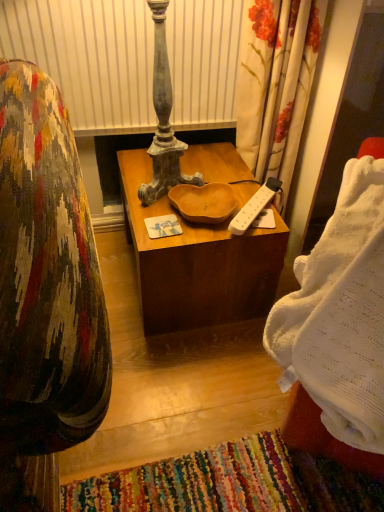
Locate an element on the screen. Image resolution: width=384 pixels, height=512 pixels. vacant point to the left of white knitted blanket at right is located at coordinates (195, 396).